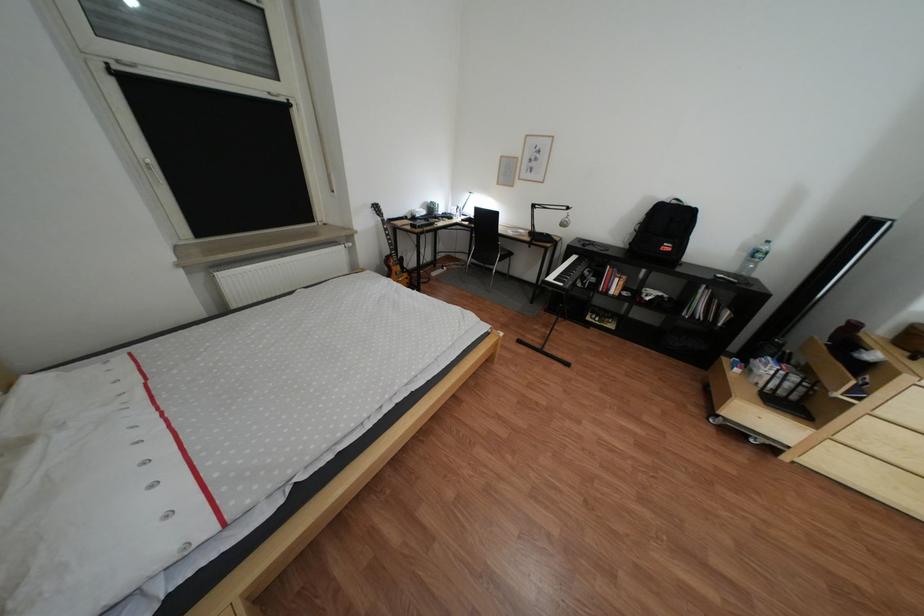
Find the location of a particular element. chair sitting surface is located at coordinates (497, 253).